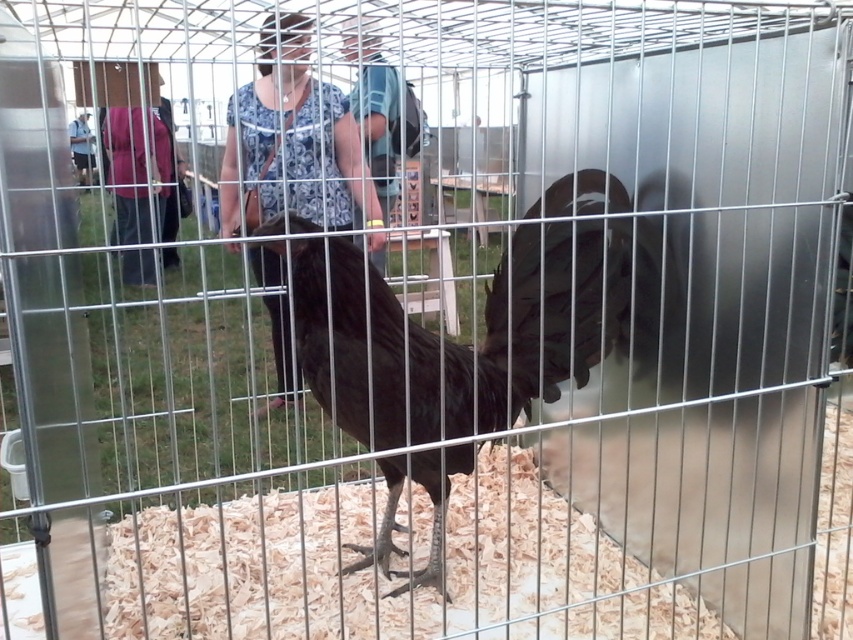
Question: Estimate the real-world distances between objects in this image. Which object is closer to the matte purple shirt at left?

Choices:
 (A) shiny black rooster at center
 (B) blue floral shirt at center
 (C) denim jacket at upper left

Answer: (C)

Question: Is matte purple shirt at left below denim jacket at upper left?

Choices:
 (A) no
 (B) yes

Answer: (B)

Question: Estimate the real-world distances between objects in this image. Which object is farther from the blue floral shirt at center?

Choices:
 (A) shiny black rooster at center
 (B) denim jacket at upper left
 (C) matte purple shirt at left

Answer: (B)

Question: Which point is farther to the camera?

Choices:
 (A) blue floral shirt at center
 (B) matte purple shirt at left
 (C) denim jacket at upper left
 (D) shiny black rooster at center

Answer: (C)

Question: Is blue floral shirt at center to the left of matte purple shirt at left from the viewer's perspective?

Choices:
 (A) yes
 (B) no

Answer: (B)

Question: Is blue floral shirt at center positioned before denim jacket at upper left?

Choices:
 (A) no
 (B) yes

Answer: (B)